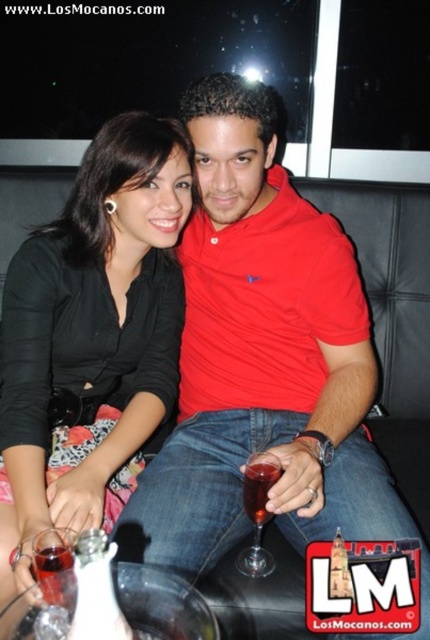
You are a bartender in a dimly lit bar. You need to place a tray of drinks between the two points labeled point (x=52, y=605) and point (x=37, y=579). Which point should the tray be closer to in order to be in front of both?

The tray should be closer to point (x=52, y=605) because it is in front of point (x=37, y=579).

You are a bartender who needs to place a 10 cm wide coaster under the translucent glass wine glass at center. Considering the width of the matte black shirt at center, will the coaster fit without overlapping the shirt?

The matte black shirt at center might be wider than the translucent glass wine glass at center, so the coaster may not fit properly as the shirt could be wider than the glass, potentially causing overlap.

You are a bartender trying to clean up after closing. You see the matte black shirt at center and the translucent glass at lower left. Which item should you prioritize cleaning first if the glass might have spilled onto the shirt?

The translucent glass at lower left should be prioritized because it is positioned to the left of the matte black shirt at center, meaning any spill would likely flow onto the shirt.